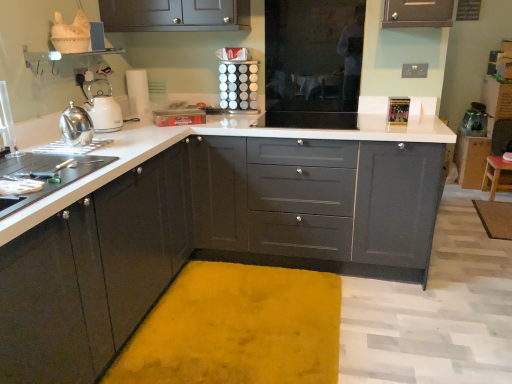
Identify the location of vacant space in yellow plush bath mat at lower right, the 1th bath mat from the top (from a real-world perspective). (498, 214).